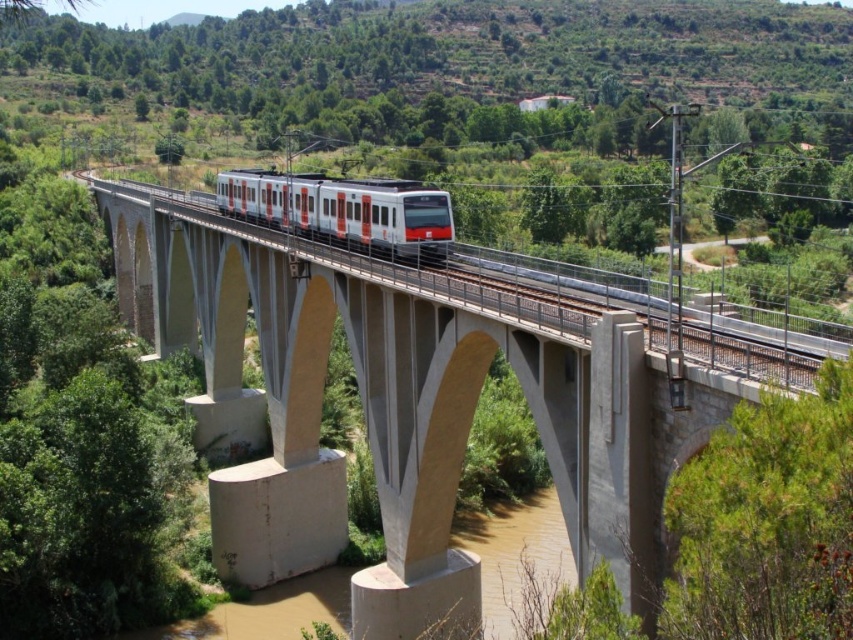
You are a maintenance worker needing to inspect the white concrete bridge at center and the white glossy train at center. You have a 12 meter long inspection ladder. Can you safely reach both objects with the ladder without moving it?

The white concrete bridge at center is 13.67 meters away from the white glossy train at center. Since the ladder is only 12 meters long, it cannot span the distance between them. Therefore, you cannot safely reach both objects with the ladder without moving it.

You are a photographer standing at the base of the viaduct, trying to capture the electric train as it passes by. You notice two points marked on your camera screen at coordinates point (374, 426) and point (317, 193). Which of these points is closer to your camera lens?

Point (374, 426) is closer to the viewer than point (317, 193), so the point at coordinates point (374, 426) is closer to your camera lens.